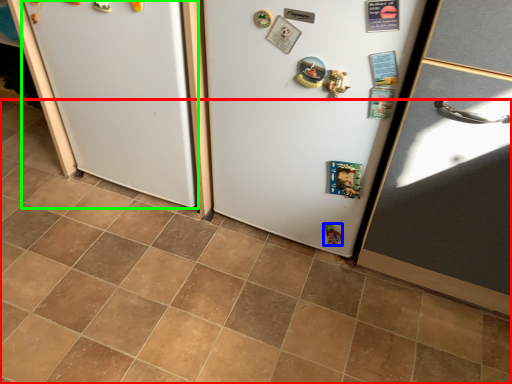
Question: Which object is the closest to the tile (highlighted by a red box)? Choose among these: toy (highlighted by a blue box) or fridge (highlighted by a green box).

Choices:
 (A) toy
 (B) fridge

Answer: (B)